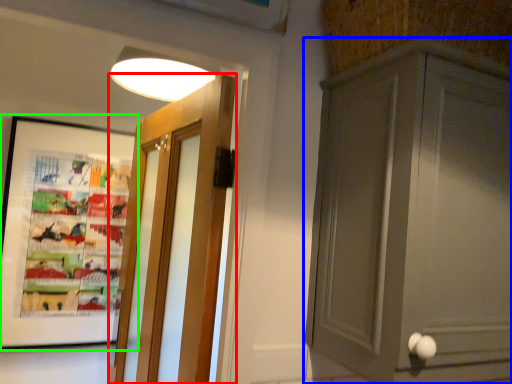
Question: Based on their relative distances, which object is nearer to door (highlighted by a red box)? Choose from cabinetry (highlighted by a blue box) and picture frame (highlighted by a green box).

Choices:
 (A) cabinetry
 (B) picture frame

Answer: (B)